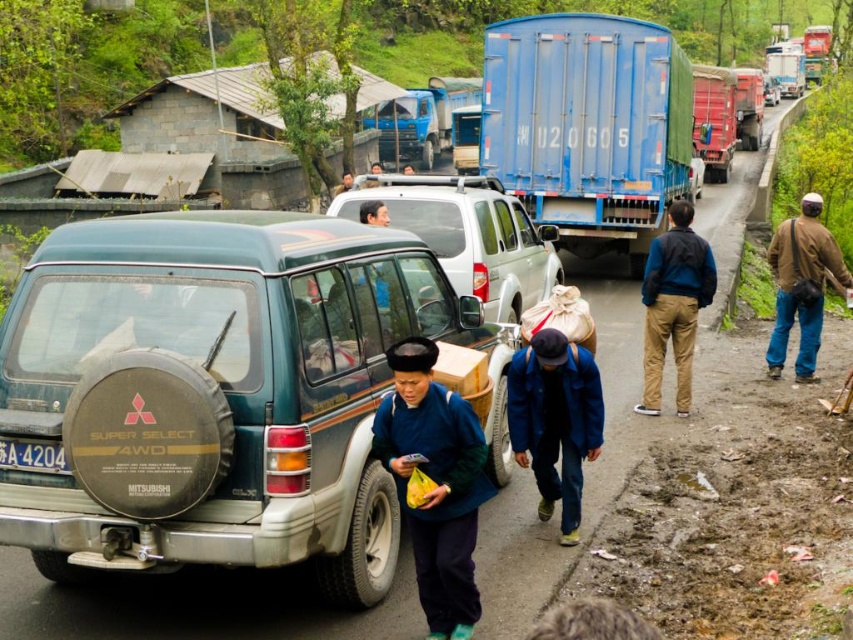
Question: Estimate the real-world distances between objects in this image. Which object is closer to the silver metallic minivan at center?

Choices:
 (A) brown cotton pants at right
 (B) teal matte suv at center
 (C) white plastic license plate at lower left
 (D) blue fabric jacket at center

Answer: (A)

Question: Observing the image, what is the correct spatial positioning of silver metallic minivan at center in reference to blue fabric jacket at center?

Choices:
 (A) left
 (B) right

Answer: (A)

Question: Which object is the closest to the brown leather jacket at right?

Choices:
 (A) silver metallic minivan at center
 (B) blue fabric jacket at center
 (C) blue cotton jacket at center
 (D) brown cotton pants at right

Answer: (D)

Question: Can you confirm if blue cotton jacket at center is positioned above brown leather jacket at right?

Choices:
 (A) no
 (B) yes

Answer: (A)

Question: Which of the following is the closest to the observer?

Choices:
 (A) (390, 403)
 (B) (799, 257)
 (C) (53, 451)

Answer: (C)

Question: Can you confirm if teal matte suv at center is positioned to the right of brown cotton pants at right?

Choices:
 (A) no
 (B) yes

Answer: (A)